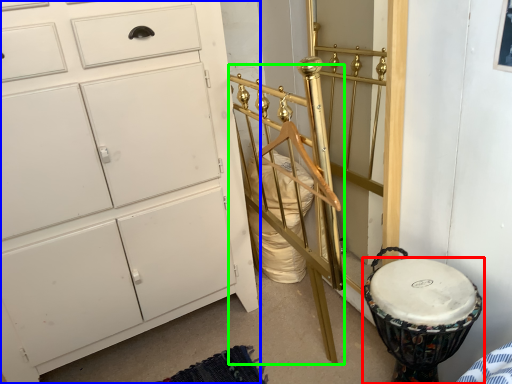
Question: Which is nearer to the drum (highlighted by a red box)? chest of drawers (highlighted by a blue box) or bed frame (highlighted by a green box).

Choices:
 (A) chest of drawers
 (B) bed frame

Answer: (B)